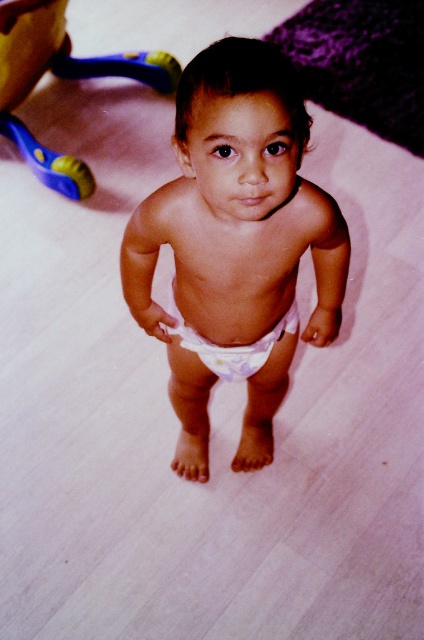
Who is higher up, blue plastic walker at upper left or white fabric diaper at center?

blue plastic walker at upper left

The height and width of the screenshot is (640, 424). Identify the location of blue plastic walker at upper left. (122, 67).

Is point (175, 81) behind point (239, 364)?

Yes.

Identify the location of blue plastic walker at upper left. (122, 67).

Between point (176, 460) and point (162, 52), which one is positioned in front?

Point (176, 460) is in front.

Does white cloth diaper at center have a lesser width compared to blue plastic walker at upper left?

Correct, white cloth diaper at center's width is less than blue plastic walker at upper left's.

Between point (284, 276) and point (175, 74), which one is positioned in front?

Point (284, 276)

This screenshot has width=424, height=640. Identify the location of white cloth diaper at center. (236, 246).

Looking at this image, is white cloth diaper at center wider than white fabric diaper at center?

Correct, the width of white cloth diaper at center exceeds that of white fabric diaper at center.

Who is shorter, white cloth diaper at center or white fabric diaper at center?

With less height is white fabric diaper at center.

Is point (197, 371) closer to camera compared to point (228, 356)?

No, (197, 371) is behind (228, 356).

This screenshot has height=640, width=424. I want to click on white cloth diaper at center, so click(236, 246).